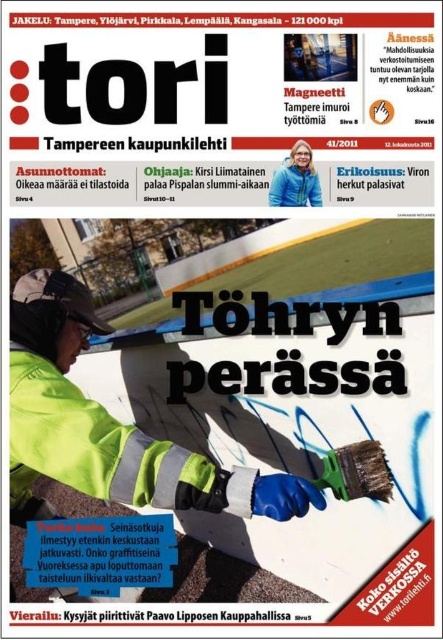
You are a fashion designer looking at the magazine cover and notice the green fabric jacket at center and the green metallic brush at center. Which object is positioned in front of the other?

The green fabric jacket at center is closer to the viewer than the green metallic brush at center, so the green fabric jacket at center is positioned in front of the green metallic brush at center.

You are looking at the magazine cover. There are two points marked on it. The first point is at coordinates point (299, 502) and the second point is at point (322, 472). From your perspective, which point is closer to you?

Point (299, 502) is in front of point (322, 472), so the first point is closer to you.